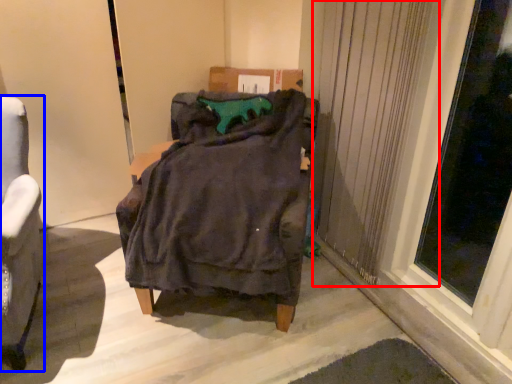
Question: Among these objects, which one is farthest to the camera, curtain (highlighted by a red box) or chair (highlighted by a blue box)?

Choices:
 (A) curtain
 (B) chair

Answer: (A)